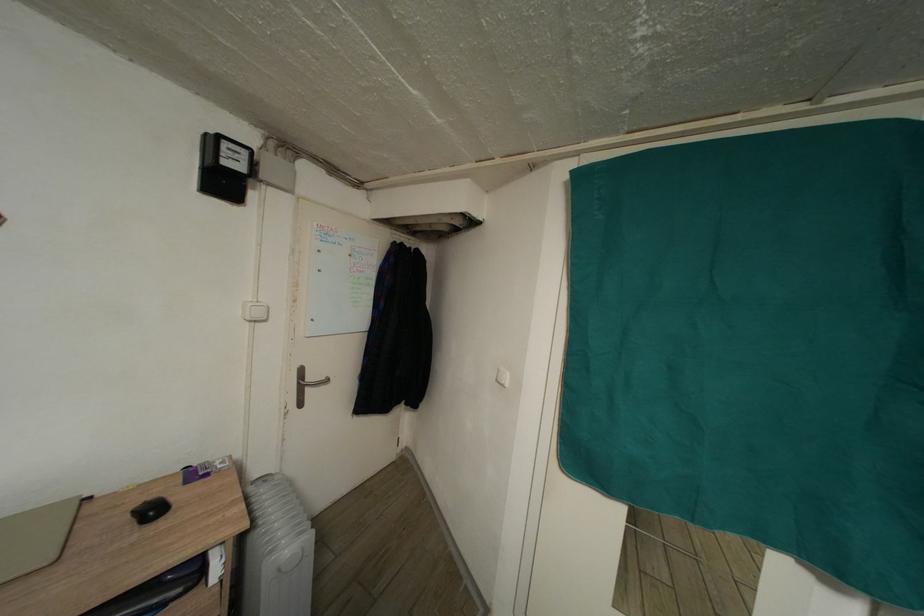
Where is `white light switch`? The width and height of the screenshot is (924, 616). white light switch is located at coordinates (502, 377).